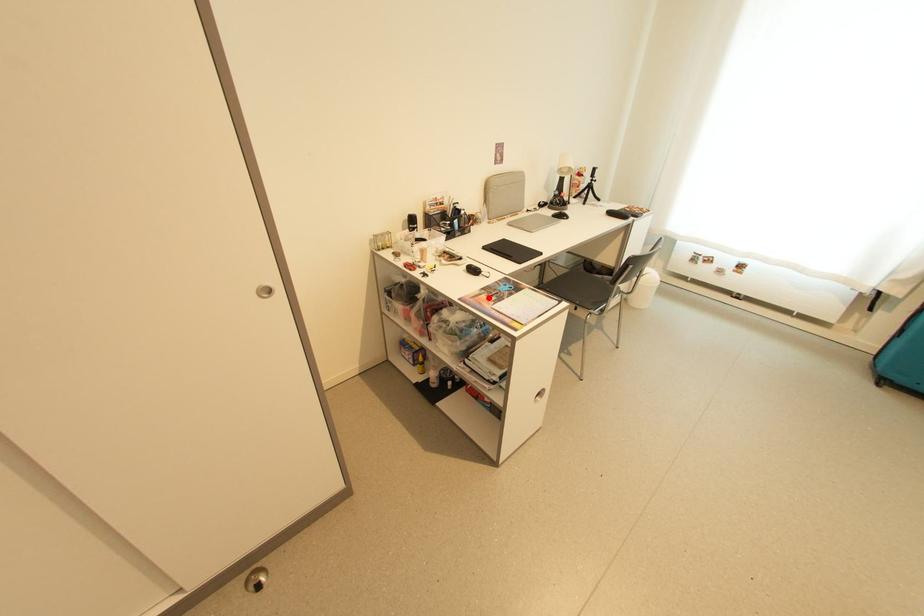
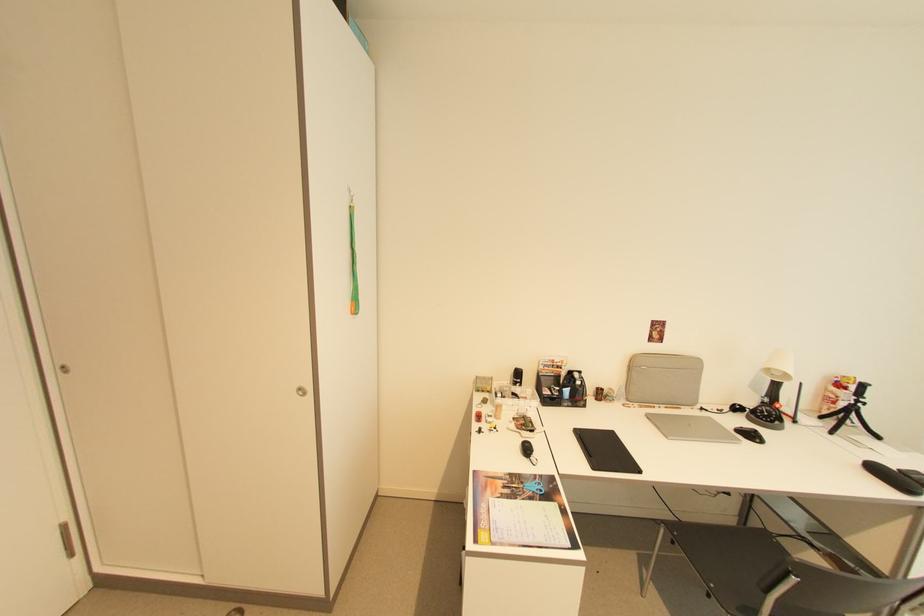
Find the pixel in the second image that matches the highlighted location in the first image.

(505, 484)